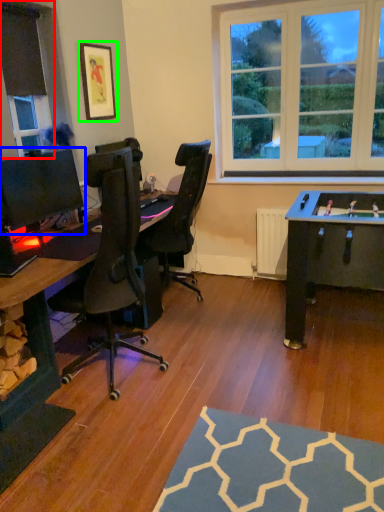
Question: Based on their relative distances, which object is nearer to window frame (highlighted by a red box)? Choose from computer monitor (highlighted by a blue box) and picture frame (highlighted by a green box).

Choices:
 (A) computer monitor
 (B) picture frame

Answer: (B)